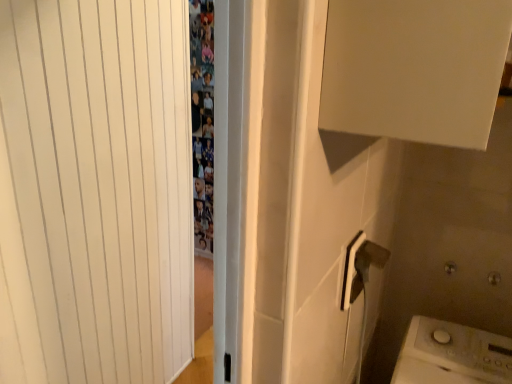
Describe the element at coordinates (350, 268) in the screenshot. This screenshot has width=512, height=384. I see `white plastic electric outlet at upper right` at that location.

Where is `white plastic electric outlet at upper right`? white plastic electric outlet at upper right is located at coordinates (350, 268).

Where is `white plastic electric outlet at upper right`? The width and height of the screenshot is (512, 384). white plastic electric outlet at upper right is located at coordinates (350, 268).